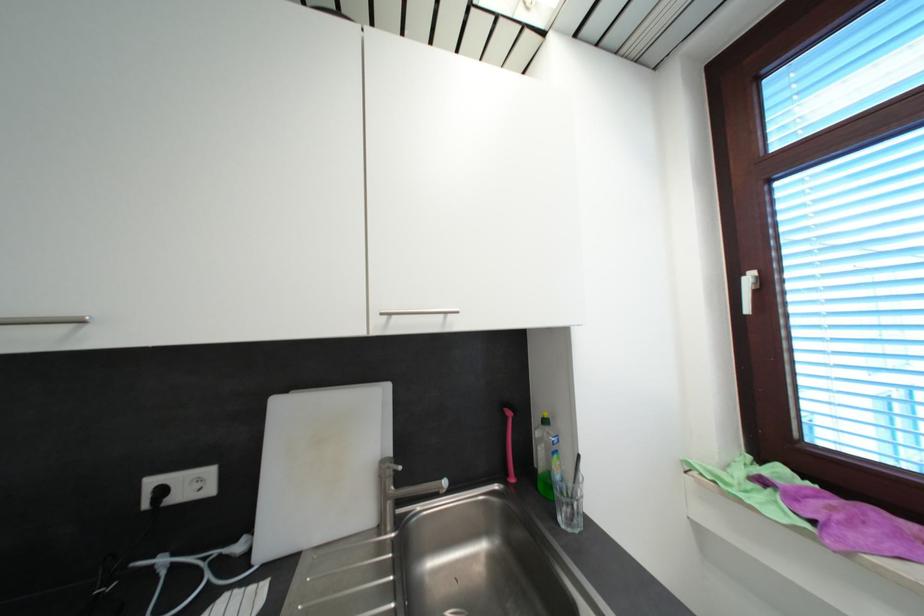
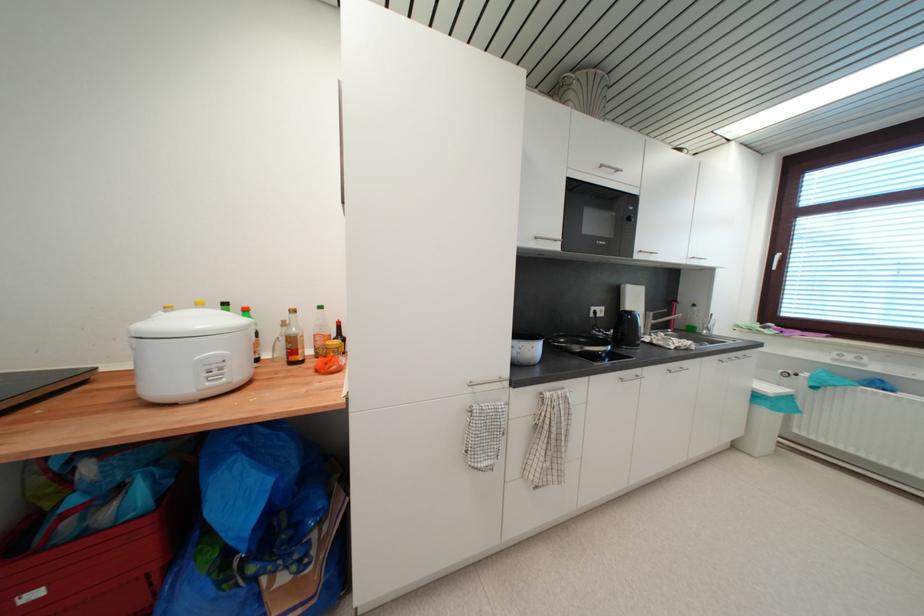
Locate, in the second image, the point that corresponds to pixel 395 315 in the first image.

(697, 261)